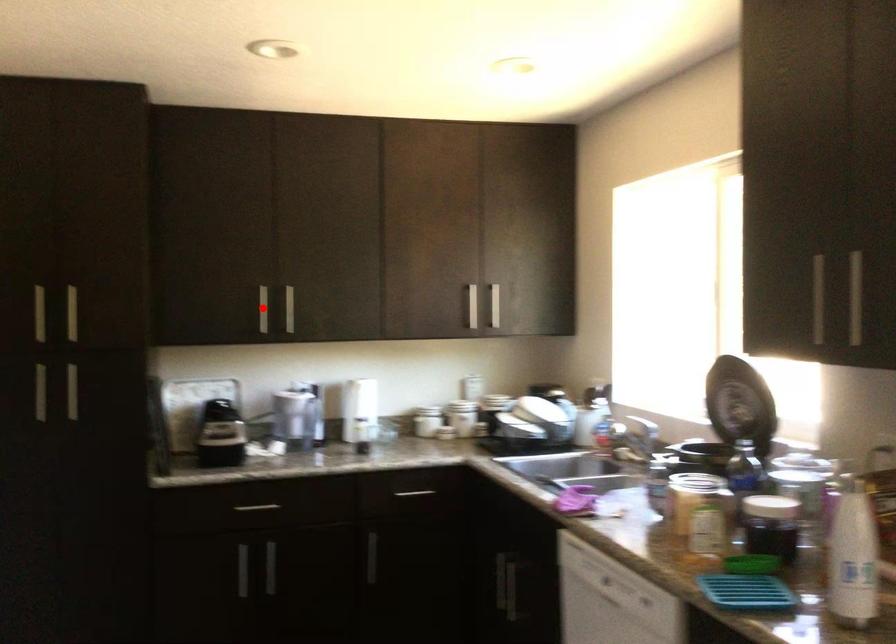
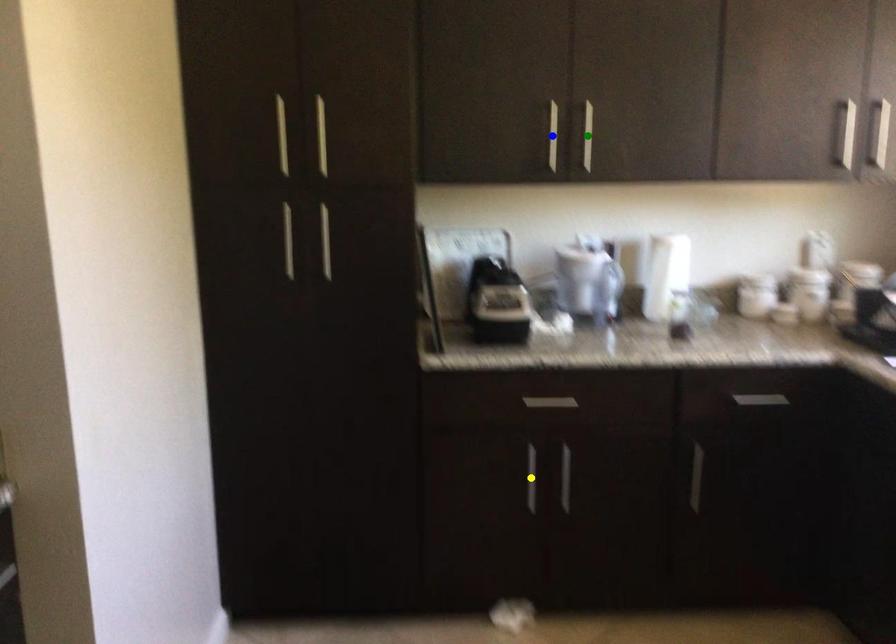
Question: I am providing you with two images of the same scene from different viewpoints. A red point is marked on the first image. You are given multiple points on the second image. Which point in image 2 represents the same 3d spot as the red point in image 1?

Choices:
 (A) blue point
 (B) yellow point
 (C) green point

Answer: (A)